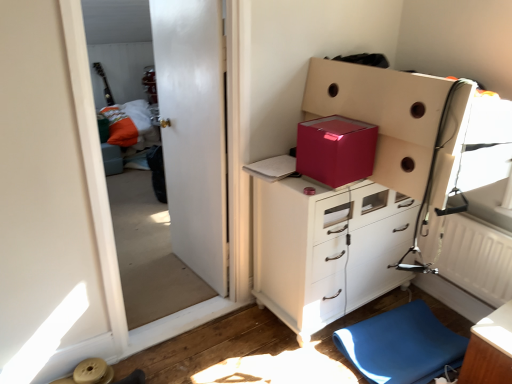
What is the approximate width of white textured radiator at lower right?

It is 3.82 inches.

Image resolution: width=512 pixels, height=384 pixels. Describe the element at coordinates (490, 350) in the screenshot. I see `wooden table at lower right` at that location.

Locate an element on the screen. blue rubber mat at lower right is located at coordinates (401, 345).

This screenshot has width=512, height=384. I want to click on white glossy door at upper left, so click(x=148, y=247).

In order to face matte white cabinet at center, should I rotate leftwards or rightwards?

To align with it, rotate right about 11.129°.

Find the location of a particular element. The height and width of the screenshot is (384, 512). matte white cabinet at center is located at coordinates (326, 249).

What do you see at coordinates (383, 115) in the screenshot? I see `matte pink cardboard box at upper right, placed as the second cardboard box when sorted from left to right` at bounding box center [383, 115].

Locate an element on the screen. This screenshot has width=512, height=384. white textured radiator at lower right is located at coordinates (472, 256).

Are glossy cardboard box at upper center, which is counted as the first cardboard box, starting from the left, and white textured radiator at lower right beside each other?

They are not placed beside each other.

Between glossy cardboard box at upper center, which is counted as the first cardboard box, starting from the left, and white textured radiator at lower right, which one has less height?

glossy cardboard box at upper center, which is counted as the first cardboard box, starting from the left, is shorter.

Does point (340, 184) come farther from viewer compared to point (487, 233)?

No.

Which object is positioned more to the right, glossy cardboard box at upper center, which is counted as the first cardboard box, starting from the left, or white textured radiator at lower right?

white textured radiator at lower right.

Is glossy cardboard box at upper center, which ranks as the second cardboard box in right-to-left order, positioned far away from matte white cabinet at center?

Actually, glossy cardboard box at upper center, which ranks as the second cardboard box in right-to-left order, and matte white cabinet at center are a little close together.

Is glossy cardboard box at upper center, which ranks as the second cardboard box in right-to-left order, positioned beyond the bounds of matte white cabinet at center?

glossy cardboard box at upper center, which ranks as the second cardboard box in right-to-left order, lies outside matte white cabinet at center's area.

At what (x,y) coordinates should I click in order to perform the action: click on chest of drawers below the glossy cardboard box at upper center, which ranks as the second cardboard box in right-to-left order (from the image's perspective). Please return your answer as a coordinate pair (x, y). Looking at the image, I should click on (326, 249).

From a real-world perspective, which is physically below, glossy cardboard box at upper center, which ranks as the second cardboard box in right-to-left order, or orange fabric bed at left?

orange fabric bed at left, from a real-world perspective.

Is glossy cardboard box at upper center, which is counted as the first cardboard box, starting from the left, spatially inside orange fabric bed at left, or outside of it?

glossy cardboard box at upper center, which is counted as the first cardboard box, starting from the left, is located beyond the bounds of orange fabric bed at left.

The image size is (512, 384). I want to click on bed lying above the glossy cardboard box at upper center, which is counted as the first cardboard box, starting from the left (from the image's perspective), so click(131, 125).

Which object is wider, glossy cardboard box at upper center, which is counted as the first cardboard box, starting from the left, or orange fabric bed at left?

orange fabric bed at left.

Is point (260, 281) positioned after point (348, 166)?

Yes, point (260, 281) is farther from viewer.

Considering the positions of objects matte white cabinet at center and glossy cardboard box at upper center, which ranks as the second cardboard box in right-to-left order, in the image provided, who is in front, matte white cabinet at center or glossy cardboard box at upper center, which ranks as the second cardboard box in right-to-left order,?

glossy cardboard box at upper center, which ranks as the second cardboard box in right-to-left order.

From the image's perspective, is matte white cabinet at center located above or below glossy cardboard box at upper center, which ranks as the second cardboard box in right-to-left order?

Based on their image positions, matte white cabinet at center is located beneath glossy cardboard box at upper center, which ranks as the second cardboard box in right-to-left order.

Does point (498, 236) lie behind point (342, 152)?

Yes, point (498, 236) is farther from viewer.

From a real-world perspective, who is located higher, white textured radiator at lower right or glossy cardboard box at upper center, which is counted as the first cardboard box, starting from the left?

In real-world perspective, glossy cardboard box at upper center, which is counted as the first cardboard box, starting from the left, is above.

Is white textured radiator at lower right facing away from glossy cardboard box at upper center, which is counted as the first cardboard box, starting from the left?

No, white textured radiator at lower right's orientation is not away from glossy cardboard box at upper center, which is counted as the first cardboard box, starting from the left.

Is white textured radiator at lower right closer to the viewer compared to glossy cardboard box at upper center, which ranks as the second cardboard box in right-to-left order?

That is False.

Measure the distance from white textured radiator at lower right to wooden table at lower right.

white textured radiator at lower right is 13.99 inches from wooden table at lower right.

From the picture: From the image's perspective, is white textured radiator at lower right above or below wooden table at lower right?

Clearly, from the image's perspective, white textured radiator at lower right is above wooden table at lower right.

Is white textured radiator at lower right positioned with its back to wooden table at lower right?

No.

Considering the sizes of objects matte pink cardboard box at upper right, marked as the first cardboard box in a right-to-left arrangement, and white textured radiator at lower right in the image provided, who is smaller, matte pink cardboard box at upper right, marked as the first cardboard box in a right-to-left arrangement, or white textured radiator at lower right?

white textured radiator at lower right is smaller.

Considering the relative sizes of matte pink cardboard box at upper right, marked as the first cardboard box in a right-to-left arrangement, and white textured radiator at lower right in the image provided, is matte pink cardboard box at upper right, marked as the first cardboard box in a right-to-left arrangement, thinner than white textured radiator at lower right?

No, matte pink cardboard box at upper right, marked as the first cardboard box in a right-to-left arrangement, is not thinner than white textured radiator at lower right.

Based on the photo, would you consider matte pink cardboard box at upper right, marked as the first cardboard box in a right-to-left arrangement, to be distant from white textured radiator at lower right?

No, matte pink cardboard box at upper right, marked as the first cardboard box in a right-to-left arrangement, is not far from white textured radiator at lower right.

Locate an element on the screen. cardboard box that is the 1st one when counting forward from the white textured radiator at lower right is located at coordinates (336, 150).

At what (x,y) coordinates should I click in order to perform the action: click on cardboard box that is the 2nd object above the matte white cabinet at center (from a real-world perspective). Please return your answer as a coordinate pair (x, y). This screenshot has height=384, width=512. Looking at the image, I should click on [336, 150].

Estimate the real-world distances between objects in this image. Which object is closer to matte white cabinet at center, wooden table at lower right or glossy cardboard box at upper center, which ranks as the second cardboard box in right-to-left order?

Among the two, glossy cardboard box at upper center, which ranks as the second cardboard box in right-to-left order, is located nearer to matte white cabinet at center.

Looking at the image, which one is located further to matte pink cardboard box at upper right, placed as the second cardboard box when sorted from left to right, glossy cardboard box at upper center, which is counted as the first cardboard box, starting from the left, or white textured radiator at lower right?

white textured radiator at lower right.

Based on their spatial positions, is orange fabric bed at left or white textured radiator at lower right further from blue rubber mat at lower right?

Based on the image, orange fabric bed at left appears to be further to blue rubber mat at lower right.

When comparing their distances from blue rubber mat at lower right, does orange fabric bed at left or wooden table at lower right seem closer?

wooden table at lower right is closer to blue rubber mat at lower right.

Which object lies further to the anchor point white textured radiator at lower right, glossy cardboard box at upper center, which is counted as the first cardboard box, starting from the left, or orange fabric bed at left?

orange fabric bed at left is further to white textured radiator at lower right.

When comparing their distances from matte pink cardboard box at upper right, marked as the first cardboard box in a right-to-left arrangement, does white glossy door at upper left or white textured radiator at lower right seem further?

white glossy door at upper left.

Estimate the real-world distances between objects in this image. Which object is closer to blue rubber mat at lower right, white glossy door at upper left or glossy cardboard box at upper center, which is counted as the first cardboard box, starting from the left?

glossy cardboard box at upper center, which is counted as the first cardboard box, starting from the left.

When comparing their distances from glossy cardboard box at upper center, which ranks as the second cardboard box in right-to-left order, does white glossy door at upper left or blue rubber mat at lower right seem closer?

Based on the image, blue rubber mat at lower right appears to be nearer to glossy cardboard box at upper center, which ranks as the second cardboard box in right-to-left order.

At what (x,y) coordinates should I click in order to perform the action: click on chest of drawers between glossy cardboard box at upper center, which ranks as the second cardboard box in right-to-left order, and white textured radiator at lower right. Please return your answer as a coordinate pair (x, y). Image resolution: width=512 pixels, height=384 pixels. Looking at the image, I should click on (326, 249).

Identify the location of radiator between glossy cardboard box at upper center, which ranks as the second cardboard box in right-to-left order, and wooden table at lower right in the up-down direction. This screenshot has width=512, height=384. (472, 256).

Locate an element on the screen. cardboard box between matte pink cardboard box at upper right, marked as the first cardboard box in a right-to-left arrangement, and matte white cabinet at center in the up-down direction is located at coordinates (336, 150).

Identify the location of cardboard box situated between white glossy door at upper left and matte pink cardboard box at upper right, marked as the first cardboard box in a right-to-left arrangement, from left to right. This screenshot has height=384, width=512. (336, 150).